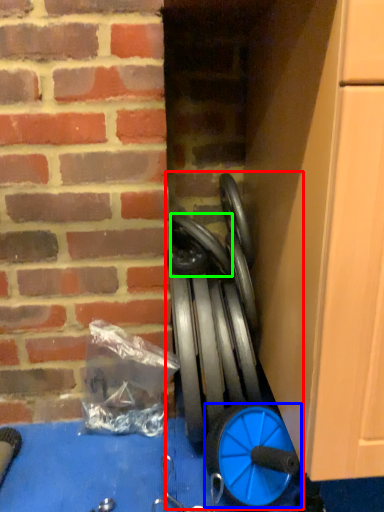
Question: Based on their relative distances, which object is farther from sport equipment (highlighted by a red box)? Choose from wheel (highlighted by a blue box) and car tire (highlighted by a green box).

Choices:
 (A) wheel
 (B) car tire

Answer: (B)